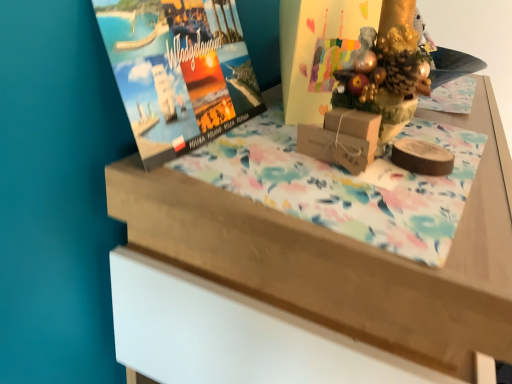
The height and width of the screenshot is (384, 512). What do you see at coordinates (179, 71) in the screenshot? I see `matte paper magazine at upper left` at bounding box center [179, 71].

Where is `matte paper magazine at upper left`? matte paper magazine at upper left is located at coordinates (179, 71).

Does wooden table at upper center turn towards brown cardboard box at center?

No, wooden table at upper center is not facing towards brown cardboard box at center.

Between wooden table at upper center and brown cardboard box at center, which one is positioned behind?

Positioned behind is brown cardboard box at center.

Are wooden table at upper center and brown cardboard box at center far apart?

Actually, wooden table at upper center and brown cardboard box at center are a little close together.

Considering the sizes of objects wooden table at upper center and brown cardboard box at center in the image provided, who is thinner, wooden table at upper center or brown cardboard box at center?

Thinner between the two is brown cardboard box at center.

From a real-world perspective, is matte paper magazine at upper left positioned above or below brown cardboard box at center?

From a real-world perspective, matte paper magazine at upper left is physically above brown cardboard box at center.

Between matte paper magazine at upper left and brown cardboard box at center, which one is positioned behind?

brown cardboard box at center is behind.

Is matte paper magazine at upper left oriented towards brown cardboard box at center?

Yes, matte paper magazine at upper left is turned towards brown cardboard box at center.

Can you tell me how much matte paper magazine at upper left and brown cardboard box at center differ in facing direction?

16.5 degrees separate the facing orientations of matte paper magazine at upper left and brown cardboard box at center.

Based on their sizes in the image, would you say brown cardboard box at center is bigger or smaller than matte paper magazine at upper left?

In the image, brown cardboard box at center appears to be smaller than matte paper magazine at upper left.

From a real-world perspective, is brown cardboard box at center under matte paper magazine at upper left?

Yes, from a real-world perspective, brown cardboard box at center is beneath matte paper magazine at upper left.

Is brown cardboard box at center positioned with its back to matte paper magazine at upper left?

Yes, brown cardboard box at center is facing away from matte paper magazine at upper left.

Considering the points (298, 95) and (331, 127), which point is behind, point (298, 95) or point (331, 127)?

The point (298, 95) is farther from the camera.

Does matte cardboard book cover at center come in front of brown cardboard box at center?

That is False.

Is matte cardboard book cover at center with brown cardboard box at center?

No, matte cardboard book cover at center is not beside brown cardboard box at center.

From a real-world perspective, between matte cardboard book cover at center and matte paper magazine at upper left, who is vertically higher?

In real-world perspective, matte cardboard book cover at center is above.

Are matte cardboard book cover at center and matte paper magazine at upper left far apart?

No.

Between matte cardboard book cover at center and matte paper magazine at upper left, which one appears on the left side from the viewer's perspective?

matte paper magazine at upper left is more to the left.

Which point is more forward, (297, 1) or (158, 38)?

Positioned in front is point (158, 38).

From a real-world perspective, is brown cardboard box at center physically below wooden table at upper center?

No.

The image size is (512, 384). Identify the location of table in front of the brown cardboard box at center. (320, 229).

Can you confirm if brown cardboard box at center is taller than wooden table at upper center?

Incorrect, the height of brown cardboard box at center is not larger of that of wooden table at upper center.

Does point (504, 216) come closer to viewer compared to point (348, 24)?

Yes, point (504, 216) is in front of point (348, 24).

In terms of width, does wooden table at upper center look wider or thinner when compared to matte cardboard book cover at center?

wooden table at upper center is wider than matte cardboard book cover at center.

Does wooden table at upper center appear on the left side of matte cardboard book cover at center?

In fact, wooden table at upper center is to the right of matte cardboard book cover at center.

From a real-world perspective, who is located lower, wooden table at upper center or matte cardboard book cover at center?

In real-world perspective, wooden table at upper center is lower.

This screenshot has height=384, width=512. Find the location of `table that appears below the brown cardboard box at center (from a real-world perspective)`. table that appears below the brown cardboard box at center (from a real-world perspective) is located at coordinates (320, 229).

Where is `magazine in front of the brown cardboard box at center`? This screenshot has height=384, width=512. magazine in front of the brown cardboard box at center is located at coordinates click(x=179, y=71).

When comparing their distances from matte cardboard book cover at center, does wooden table at upper center or matte paper magazine at upper left seem further?

Among the two, wooden table at upper center is located further to matte cardboard book cover at center.

When comparing their distances from matte paper magazine at upper left, does wooden table at upper center or matte cardboard book cover at center seem further?

Based on the image, wooden table at upper center appears to be further to matte paper magazine at upper left.

Looking at this image, based on their spatial positions, is wooden table at upper center or matte paper magazine at upper left closer to brown cardboard box at center?

matte paper magazine at upper left lies closer to brown cardboard box at center than the other object.

Considering their positions, is brown cardboard box at center positioned closer to wooden table at upper center than matte paper magazine at upper left?

The object closer to wooden table at upper center is matte paper magazine at upper left.

Looking at the image, which one is located closer to matte cardboard book cover at center, brown cardboard box at center or wooden table at upper center?

The object closer to matte cardboard book cover at center is brown cardboard box at center.

From the image, which object appears to be farther from matte paper magazine at upper left, matte cardboard book cover at center or wooden table at upper center?

wooden table at upper center is further to matte paper magazine at upper left.

Looking at the image, which one is located closer to matte paper magazine at upper left, matte cardboard book cover at center or brown cardboard box at center?

matte cardboard book cover at center lies closer to matte paper magazine at upper left than the other object.

In the scene shown: When comparing their distances from wooden table at upper center, does matte cardboard book cover at center or matte paper magazine at upper left seem closer?

matte paper magazine at upper left is positioned closer to the anchor wooden table at upper center.

At what (x,y) coordinates should I click in order to perform the action: click on cardboard box between matte paper magazine at upper left and wooden table at upper center from top to bottom. Please return your answer as a coordinate pair (x, y). Looking at the image, I should click on (342, 139).

You are a GUI agent. You are given a task and a screenshot of the screen. Output one action in this format:
    pyautogui.click(x=<x>, y=<y>)
    Task: Click on the cardboard box between matte cardboard book cover at center and wooden table at upper center vertically
    The width and height of the screenshot is (512, 384).
    Given the screenshot: What is the action you would take?
    [342, 139]

The image size is (512, 384). I want to click on cardboard box between matte paper magazine at upper left and matte cardboard book cover at center from front to back, so click(x=342, y=139).

You are a GUI agent. You are given a task and a screenshot of the screen. Output one action in this format:
    pyautogui.click(x=<x>, y=<y>)
    Task: Click on the magazine between matte cardboard book cover at center and wooden table at upper center vertically
    This screenshot has height=384, width=512.
    Given the screenshot: What is the action you would take?
    pyautogui.click(x=179, y=71)